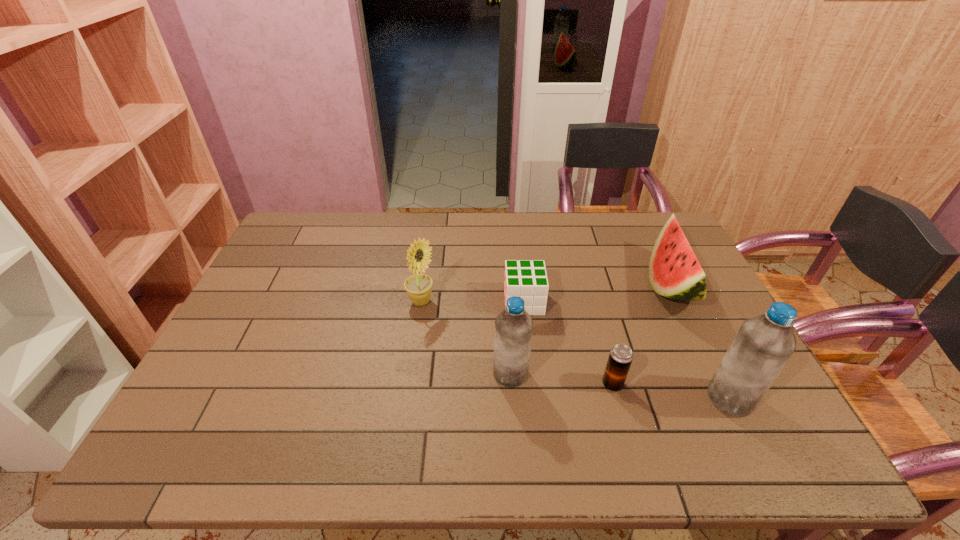
Image resolution: width=960 pixels, height=540 pixels. I want to click on the shorter water bottle, so click(x=513, y=326).

At what (x,y) coordinates should I click in order to perform the action: click on the tallest object. Please return your answer as a coordinate pair (x, y). The image size is (960, 540). Looking at the image, I should click on (763, 345).

You are a GUI agent. You are given a task and a screenshot of the screen. Output one action in this format:
    pyautogui.click(x=<x>, y=<y>)
    Task: Click on the right water bottle
    The height and width of the screenshot is (540, 960).
    Given the screenshot: What is the action you would take?
    pyautogui.click(x=763, y=345)

Identify the location of cube. (527, 279).

Identify the location of sunflower. The width and height of the screenshot is (960, 540). (419, 286).

Find the location of a particular element. This screenshot has width=960, height=540. beer can is located at coordinates (620, 358).

The height and width of the screenshot is (540, 960). I want to click on watermelon, so pos(674,272).

Where is `vacant space located 0.130m on the left of the left water bottle`? The image size is (960, 540). vacant space located 0.130m on the left of the left water bottle is located at coordinates (442, 374).

At what (x,y) coordinates should I click in order to perform the action: click on vacant point located on the back of the taller water bottle. Please return your answer as a coordinate pair (x, y). The image size is (960, 540). Looking at the image, I should click on pos(702,340).

You are a GUI agent. You are given a task and a screenshot of the screen. Output one action in this format:
    pyautogui.click(x=<x>, y=<y>)
    Task: Click on the vacant space located 0.110m on the red face of the cube
    
    Given the screenshot: What is the action you would take?
    pyautogui.click(x=468, y=302)